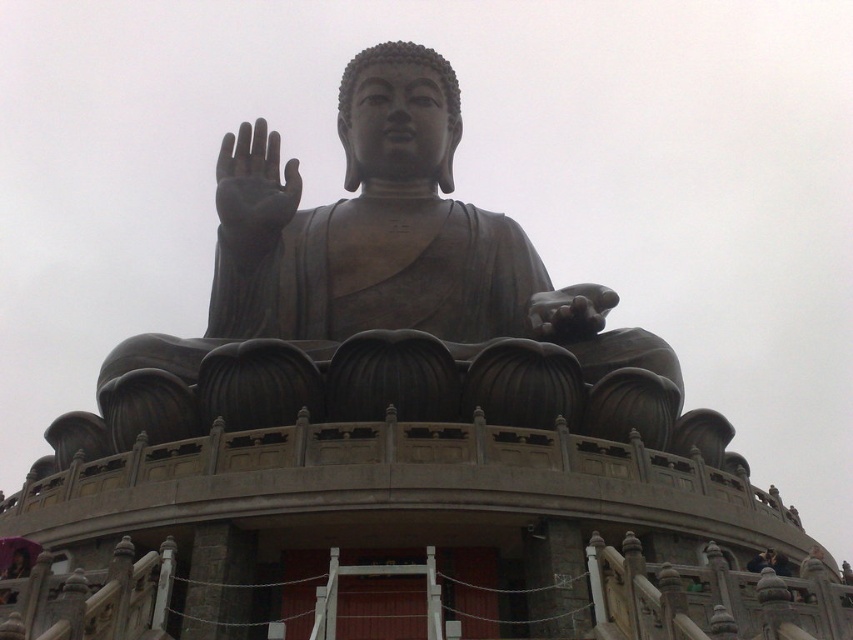
Does bronze statue at center have a larger size compared to black matte hand at upper center?

Indeed, bronze statue at center has a larger size compared to black matte hand at upper center.

The height and width of the screenshot is (640, 853). What are the coordinates of `bronze statue at center` in the screenshot? It's located at (398, 250).

Find the location of a particular element. The height and width of the screenshot is (640, 853). bronze statue at center is located at coordinates (398, 250).